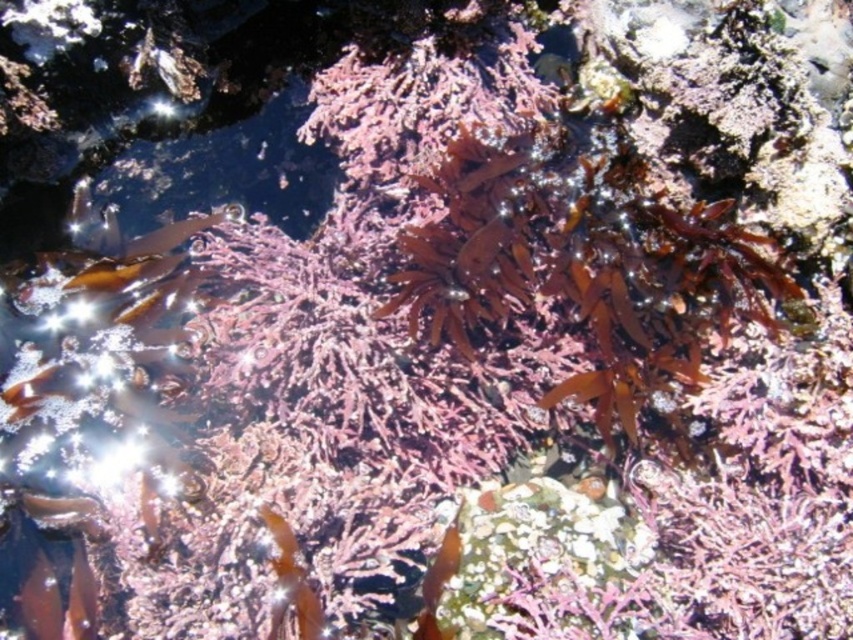
Question: Is shiny orange fish at bottom left closer to camera compared to translucent brown seaweed at lower left?

Choices:
 (A) no
 (B) yes

Answer: (B)

Question: Does shiny orange fish at bottom left lie in front of translucent brown seaweed at lower left?

Choices:
 (A) no
 (B) yes

Answer: (B)

Question: Is shiny orange fish at bottom left below translucent brown seaweed at lower left?

Choices:
 (A) no
 (B) yes

Answer: (B)

Question: Among these objects, which one is nearest to the camera?

Choices:
 (A) translucent brown seaweed at lower left
 (B) shiny orange fish at bottom left

Answer: (B)